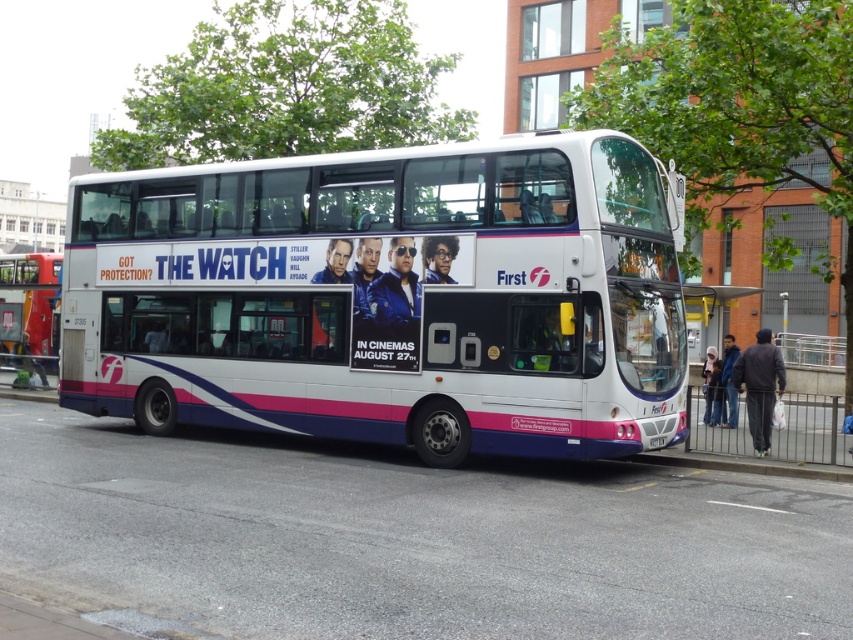
Question: Which point is closer to the camera?

Choices:
 (A) (88, 356)
 (B) (662, 444)

Answer: (B)

Question: Is white glossy decker bus at center wider than white plastic license plate at center?

Choices:
 (A) no
 (B) yes

Answer: (B)

Question: Which of the following is the closest to the observer?

Choices:
 (A) (651, 448)
 (B) (527, 376)

Answer: (B)

Question: Is white glossy decker bus at center thinner than white plastic license plate at center?

Choices:
 (A) no
 (B) yes

Answer: (A)

Question: Is white glossy decker bus at center above white plastic bus at left?

Choices:
 (A) yes
 (B) no

Answer: (A)

Question: Which of these objects is positioned closest to the white plastic bus at left?

Choices:
 (A) white plastic license plate at center
 (B) white glossy decker bus at center

Answer: (B)